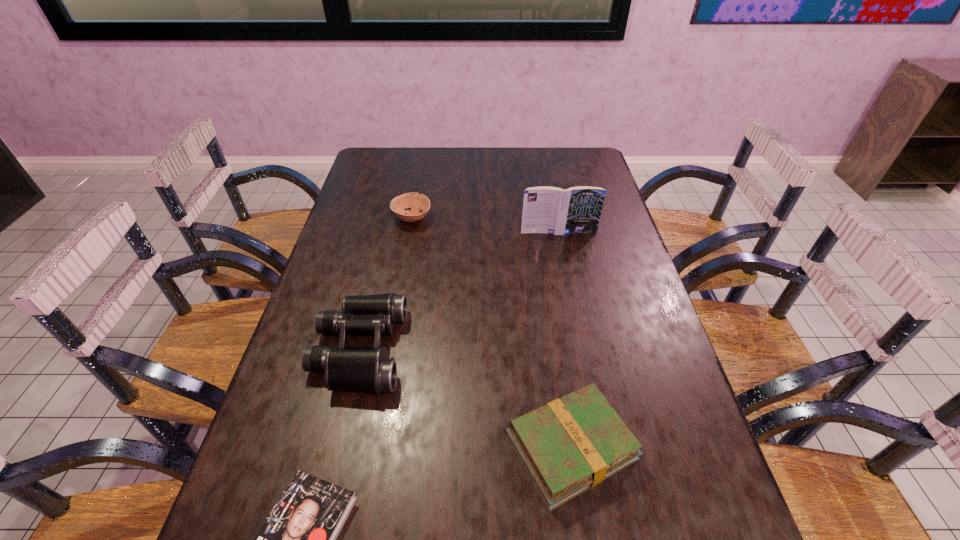
Where is `free space between the second tallest object and the tallest object`? This screenshot has height=540, width=960. free space between the second tallest object and the tallest object is located at coordinates (459, 291).

Locate an element on the screen. This screenshot has height=540, width=960. empty space that is in between the tallest object and the second tallest object is located at coordinates (459, 291).

Image resolution: width=960 pixels, height=540 pixels. Find the location of `vacant area that lies between the second tallest object and the farthest book`. vacant area that lies between the second tallest object and the farthest book is located at coordinates (459, 291).

The width and height of the screenshot is (960, 540). In order to click on free point between the binoculars and the bowl in this screenshot , I will do 386,284.

Identify which object is located as the nearest to the tallest object. Please provide its 2D coordinates. Your answer should be formatted as a tuple, i.e. [(x, y)], where the tuple contains the x and y coordinates of a point satisfying the conditions above.

[(417, 202)]

Select which object appears as the second closest to the second shortest book. Please provide its 2D coordinates. Your answer should be formatted as a tuple, i.e. [(x, y)], where the tuple contains the x and y coordinates of a point satisfying the conditions above.

[(298, 539)]

At what (x,y) coordinates should I click in order to perform the action: click on book that is the second closest to the bowl. Please return your answer as a coordinate pair (x, y). Looking at the image, I should click on (571, 444).

This screenshot has height=540, width=960. In order to click on book that stands as the second closest to the bowl in this screenshot , I will do `click(571, 444)`.

This screenshot has width=960, height=540. I want to click on vacant space that satisfies the following two spatial constraints: 1. on the front-facing side of the binoculars; 2. on the back side of the second tallest book, so click(x=335, y=446).

I want to click on blank area in the image that satisfies the following two spatial constraints: 1. on the back side of the second shortest book; 2. on the front-facing side of the binoculars, so click(556, 349).